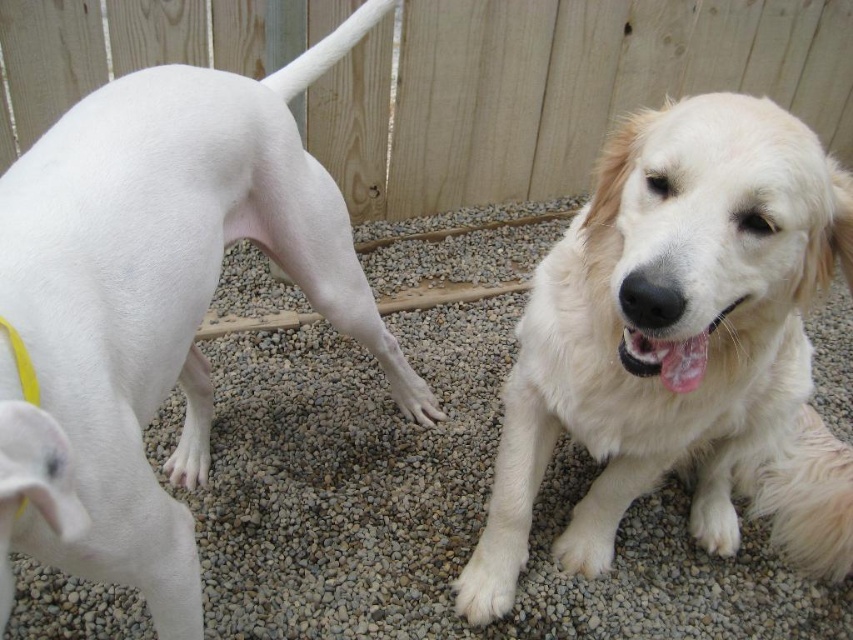
You are a photographer trying to capture a group photo of the golden fur dog at center and the wooden fence at upper center. If you want to ensure both subjects are fully visible in the frame, which subject should you position closer to the camera to avoid cropping?

The golden fur dog at center has a lesser width compared to the wooden fence at upper center, so positioning the golden fur dog at center closer to the camera would allow both subjects to fit without cropping since it is narrower.

You are a photographer trying to capture both the white smooth dog at left and the white fur paw at lower center in a single frame. Since you want to ensure both are in focus, which one should you focus on first to maximize clarity?

The white smooth dog at left is closer to the viewer than the white fur paw at lower center, so you should focus on the white smooth dog at left first to ensure both are in focus.

You are a dog owner trying to determine which object is taller between the white smooth dog at left and the white fur paw at lower center. Based on the scene, which one is taller?

The white smooth dog at left is taller than the white fur paw at lower center.